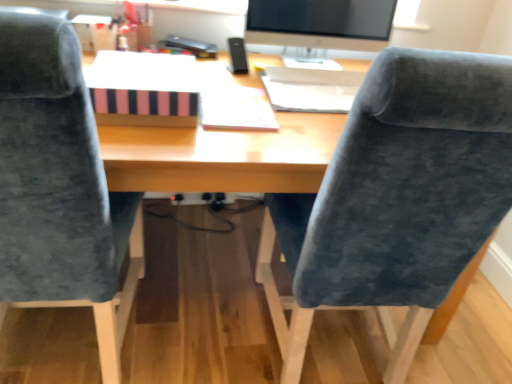
You are a GUI agent. You are given a task and a screenshot of the screen. Output one action in this format:
    pyautogui.click(x=<x>, y=<y>)
    Task: Click on the free space in front of white paper at center
    
    Given the screenshot: What is the action you would take?
    pyautogui.click(x=230, y=145)